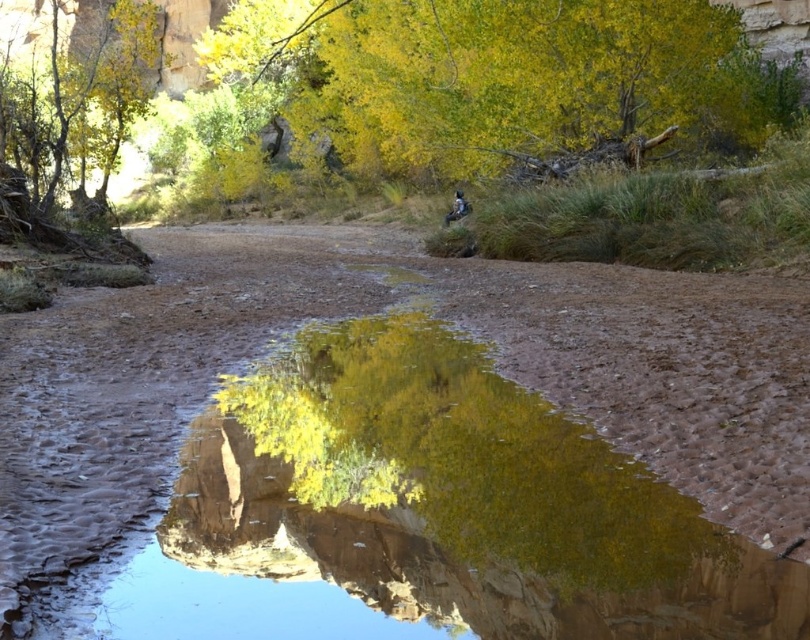
Does clear water at center come behind yellow-green foliage at upper left?

No, it is in front of yellow-green foliage at upper left.

Who is higher up, clear water at center or yellow-green foliage at upper left?

yellow-green foliage at upper left is above.

Who is more forward, (301, 252) or (45, 156)?

Point (45, 156)

The height and width of the screenshot is (640, 810). Find the location of `clear water at center`. clear water at center is located at coordinates (401, 449).

Can you confirm if clear water at center is taller than yellow leafy tree at upper center?

In fact, clear water at center may be shorter than yellow leafy tree at upper center.

Can you confirm if clear water at center is positioned to the left of yellow leafy tree at upper center?

In fact, clear water at center is to the right of yellow leafy tree at upper center.

You are a GUI agent. You are given a task and a screenshot of the screen. Output one action in this format:
    pyautogui.click(x=<x>, y=<y>)
    Task: Click on the clear water at center
    Image resolution: width=810 pixels, height=640 pixels.
    Given the screenshot: What is the action you would take?
    pyautogui.click(x=401, y=449)

Who is positioned more to the left, yellow leafy tree at upper center or yellow-green foliage at upper left?

yellow-green foliage at upper left is more to the left.

Is yellow leafy tree at upper center positioned at the back of yellow-green foliage at upper left?

Yes, it is behind yellow-green foliage at upper left.

What do you see at coordinates (488, 76) in the screenshot? The width and height of the screenshot is (810, 640). I see `yellow leafy tree at upper center` at bounding box center [488, 76].

In order to click on yellow leafy tree at upper center in this screenshot , I will do `click(488, 76)`.